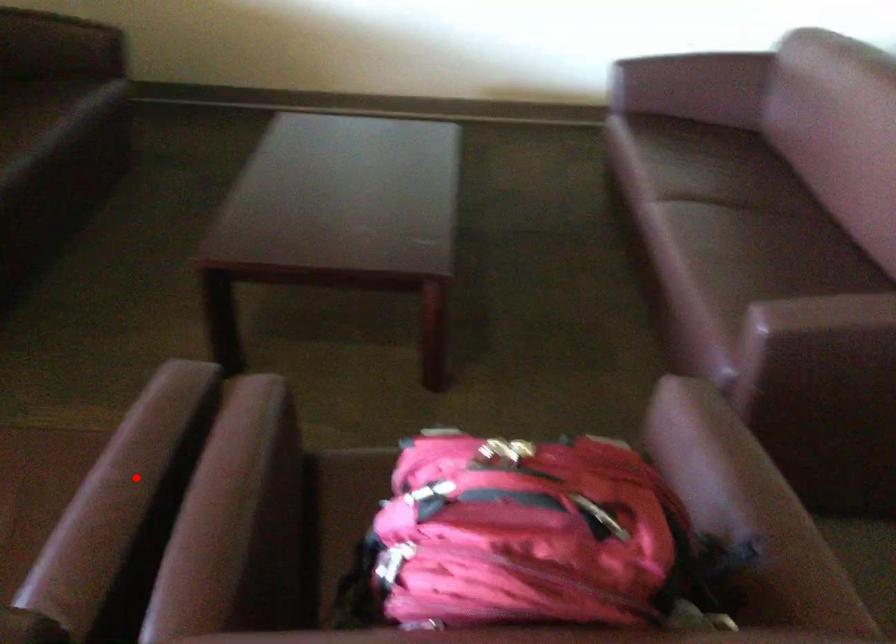
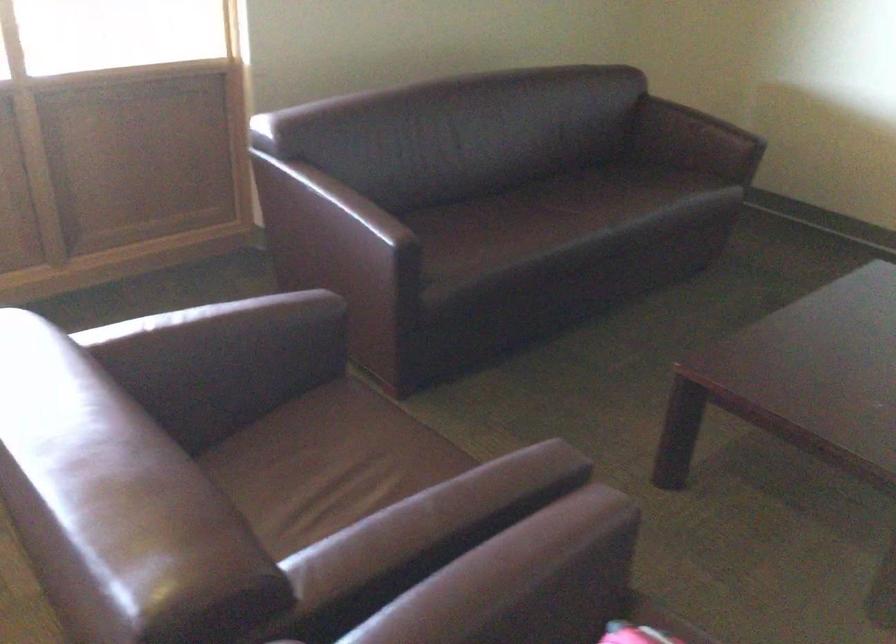
In the second image, find the point that corresponds to the highlighted location in the first image.

(431, 522)